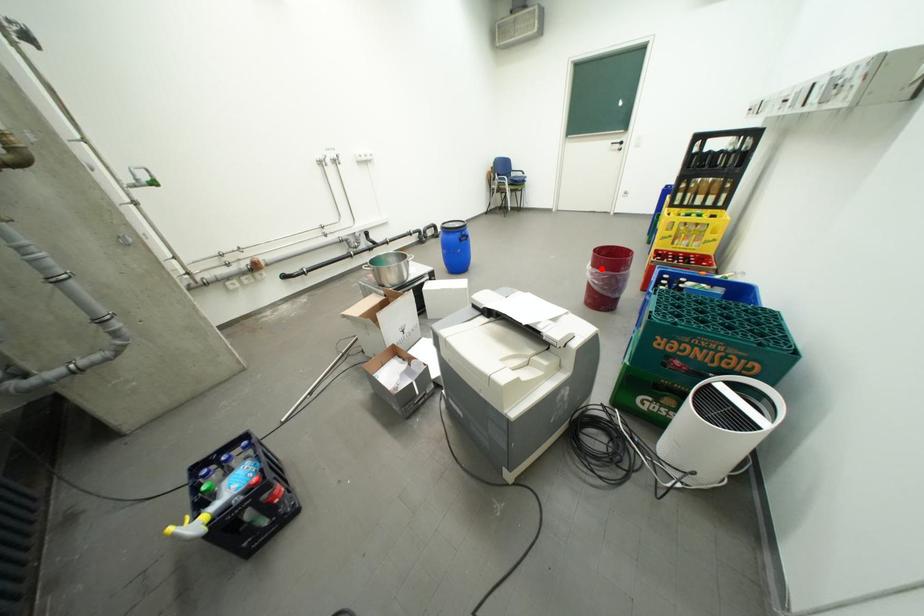
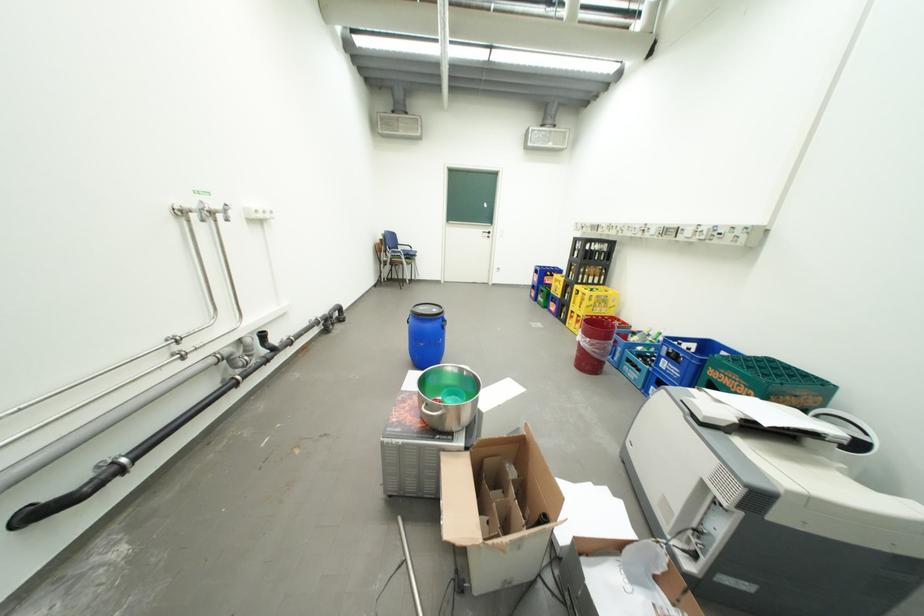
Question: A red point is marked in image1. In image2, is the corresponding 3D point closer to the camera or farther? Reply with the corresponding letter.

Choices:
 (A) The corresponding 3D point is closer.
 (B) The corresponding 3D point is farther.

Answer: (A)